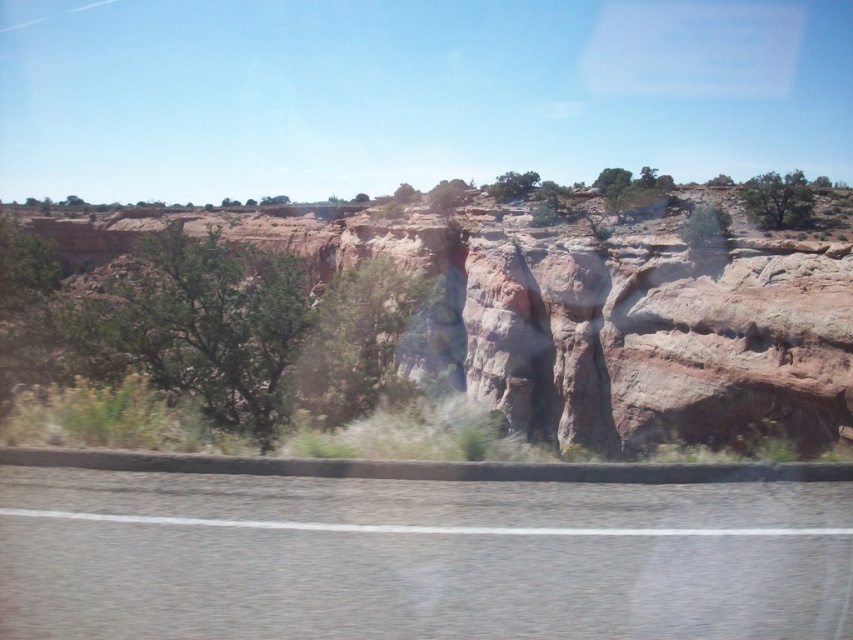
Can you confirm if gray asphalt highway at lower center is positioned to the right of rustic stone cliff at center?

Yes, gray asphalt highway at lower center is to the right of rustic stone cliff at center.

Is gray asphalt highway at lower center thinner than rustic stone cliff at center?

Correct, gray asphalt highway at lower center's width is less than rustic stone cliff at center's.

Does point (584, 564) come farther from viewer compared to point (386, 225)?

No, it is in front of (386, 225).

Image resolution: width=853 pixels, height=640 pixels. I want to click on gray asphalt highway at lower center, so click(x=418, y=557).